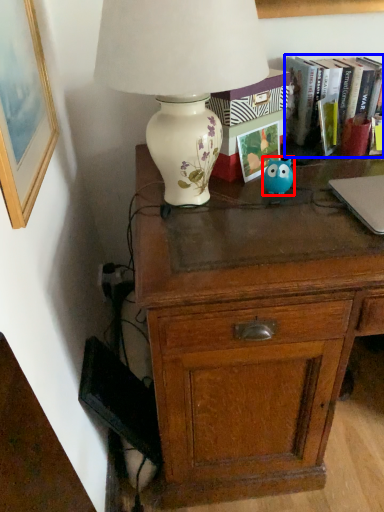
Question: Among these objects, which one is nearest to the camera, animal (highlighted by a red box) or book (highlighted by a blue box)?

Choices:
 (A) animal
 (B) book

Answer: (A)